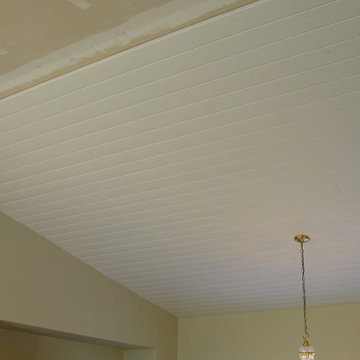
Where is `clear glass dome`? clear glass dome is located at coordinates (305, 348).